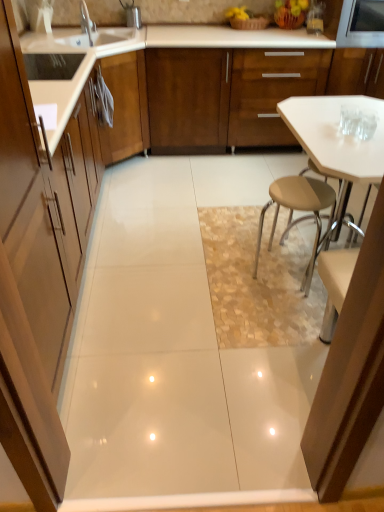
The image size is (384, 512). Describe the element at coordinates (227, 96) in the screenshot. I see `wooden cabinet at center, the second cabinetry positioned from the front` at that location.

Measure the distance between matte wood cabinet at left, which is counted as the first cabinetry, starting from the bottom, and camera.

The depth of matte wood cabinet at left, which is counted as the first cabinetry, starting from the bottom, is 35.73 inches.

What do you see at coordinates (336, 141) in the screenshot? I see `white glossy table at center` at bounding box center [336, 141].

Find the location of a particular element. The height and width of the screenshot is (512, 384). white glossy table at center is located at coordinates (336, 141).

Locate an element on the screen. The width and height of the screenshot is (384, 512). wooden cabinet at center, the second cabinetry positioned from the front is located at coordinates (227, 96).

Which object is positioned more to the right, wooden cabinet at center, the 1th cabinetry in the top-to-bottom sequence, or silver metallic faucet at upper left?

Positioned to the right is wooden cabinet at center, the 1th cabinetry in the top-to-bottom sequence.

From a real-world perspective, between wooden cabinet at center, the first cabinetry viewed from the right, and silver metallic faucet at upper left, who is vertically higher?

From a 3D spatial view, silver metallic faucet at upper left is above.

Is wooden cabinet at center, which is counted as the first cabinetry, starting from the back, not near silver metallic faucet at upper left?

Absolutely, wooden cabinet at center, which is counted as the first cabinetry, starting from the back, is distant from silver metallic faucet at upper left.

Considering the relative sizes of wooden cabinet at center, the 1th cabinetry in the top-to-bottom sequence, and silver metallic faucet at upper left in the image provided, is wooden cabinet at center, the 1th cabinetry in the top-to-bottom sequence, wider than silver metallic faucet at upper left?

Yes.

From a real-world perspective, which cabinetry is the 2nd one above the white glossy table at center? Please provide its 2D coordinates.

[(29, 292)]

Is white glossy table at center aimed at matte wood cabinet at left, placed as the second cabinetry when sorted from back to front?

Yes, white glossy table at center is turned towards matte wood cabinet at left, placed as the second cabinetry when sorted from back to front.

Does white glossy table at center have a larger size compared to matte wood cabinet at left, placed as the second cabinetry when sorted from back to front?

Correct, white glossy table at center is larger in size than matte wood cabinet at left, placed as the second cabinetry when sorted from back to front.

Which object is wider, matte wood cabinet at left, which is counted as the second cabinetry, starting from the right, or white glossy table at center?

Wider between the two is white glossy table at center.

From the image's perspective, is matte wood cabinet at left, which ranks as the 2th cabinetry in top-to-bottom order, below white glossy table at center?

Yes, from the image's perspective, matte wood cabinet at left, which ranks as the 2th cabinetry in top-to-bottom order, is beneath white glossy table at center.

Is matte wood cabinet at left, placed as the second cabinetry when sorted from back to front, to the left of white glossy table at center from the viewer's perspective?

Indeed, matte wood cabinet at left, placed as the second cabinetry when sorted from back to front, is positioned on the left side of white glossy table at center.

There is a metallic stainless steel microwave at upper right. At what (x,y) coordinates should I click in order to perform the action: click on the 2nd cabinetry below it (from the image's perspective). Please return your answer as a coordinate pair (x, y). Looking at the image, I should click on (29, 292).

Considering the relative positions of metallic stainless steel microwave at upper right and matte wood cabinet at left, placed as the second cabinetry when sorted from back to front, in the image provided, is metallic stainless steel microwave at upper right behind matte wood cabinet at left, placed as the second cabinetry when sorted from back to front,?

Yes, it is behind matte wood cabinet at left, placed as the second cabinetry when sorted from back to front.

Consider the image. Would you say metallic stainless steel microwave at upper right contains matte wood cabinet at left, which is counted as the second cabinetry, starting from the right?

No, matte wood cabinet at left, which is counted as the second cabinetry, starting from the right, is not a part of metallic stainless steel microwave at upper right.

Can you tell me how much wooden cabinet at center, positioned as the second cabinetry in bottom-to-top order, and matte wood cabinet at left, the first cabinetry when ordered from front to back, differ in facing direction?

91.9 degrees separate the facing orientations of wooden cabinet at center, positioned as the second cabinetry in bottom-to-top order, and matte wood cabinet at left, the first cabinetry when ordered from front to back.

Can you confirm if wooden cabinet at center, positioned as the second cabinetry in bottom-to-top order, is wider than matte wood cabinet at left, which is counted as the first cabinetry, starting from the bottom?

Yes, wooden cabinet at center, positioned as the second cabinetry in bottom-to-top order, is wider than matte wood cabinet at left, which is counted as the first cabinetry, starting from the bottom.

Is there a large distance between wooden cabinet at center, which appears as the second cabinetry when viewed from the left, and matte wood cabinet at left, the first cabinetry when ordered from front to back?

Yes, wooden cabinet at center, which appears as the second cabinetry when viewed from the left, and matte wood cabinet at left, the first cabinetry when ordered from front to back, are quite far apart.

How far apart are wooden cabinet at center, the first cabinetry viewed from the right, and matte wood cabinet at left, placed as the second cabinetry when sorted from back to front?

They are 2.08 meters apart.

Considering the sizes of objects wooden cabinet at center, positioned as the second cabinetry in bottom-to-top order, and metallic stainless steel microwave at upper right in the image provided, who is thinner, wooden cabinet at center, positioned as the second cabinetry in bottom-to-top order, or metallic stainless steel microwave at upper right?

wooden cabinet at center, positioned as the second cabinetry in bottom-to-top order, is thinner.

Which is behind, point (264, 114) or point (367, 11)?

The point (264, 114) is behind.

Consider the image. Does wooden cabinet at center, which appears as the second cabinetry when viewed from the left, have a lesser height compared to metallic stainless steel microwave at upper right?

In fact, wooden cabinet at center, which appears as the second cabinetry when viewed from the left, may be taller than metallic stainless steel microwave at upper right.

From the image's perspective, does wooden cabinet at center, which is counted as the first cabinetry, starting from the back, appear lower than metallic stainless steel microwave at upper right?

Yes, from the image's perspective, wooden cabinet at center, which is counted as the first cabinetry, starting from the back, is beneath metallic stainless steel microwave at upper right.

From a real-world perspective, is matte wood cabinet at left, which is counted as the first cabinetry, starting from the bottom, positioned above or below metallic stainless steel microwave at upper right?

matte wood cabinet at left, which is counted as the first cabinetry, starting from the bottom, is situated lower than metallic stainless steel microwave at upper right in the real world.

Would you say matte wood cabinet at left, the first cabinetry when ordered from front to back, is inside or outside metallic stainless steel microwave at upper right?

matte wood cabinet at left, the first cabinetry when ordered from front to back, lies outside metallic stainless steel microwave at upper right.

Is matte wood cabinet at left, which ranks as the 2th cabinetry in top-to-bottom order, in contact with metallic stainless steel microwave at upper right?

No, matte wood cabinet at left, which ranks as the 2th cabinetry in top-to-bottom order, is not in contact with metallic stainless steel microwave at upper right.

Where is `tap that is in front of the wooden cabinet at center, which is counted as the first cabinetry, starting from the back`? The width and height of the screenshot is (384, 512). tap that is in front of the wooden cabinet at center, which is counted as the first cabinetry, starting from the back is located at coordinates (87, 22).

I want to click on table above the matte wood cabinet at left, which is counted as the second cabinetry, starting from the right (from the image's perspective), so click(336, 141).

Considering their positions, is white glossy table at center positioned closer to matte wood cabinet at left, which is counted as the second cabinetry, starting from the right, than wooden cabinet at center, the second cabinetry positioned from the front?

white glossy table at center is positioned closer to the anchor matte wood cabinet at left, which is counted as the second cabinetry, starting from the right.

Considering their positions, is wooden cabinet at center, the 1th cabinetry in the top-to-bottom sequence, positioned closer to matte wood cabinet at left, which is counted as the second cabinetry, starting from the right, than silver metallic faucet at upper left?

Among the two, silver metallic faucet at upper left is located nearer to matte wood cabinet at left, which is counted as the second cabinetry, starting from the right.

When comparing their distances from wooden cabinet at center, the 1th cabinetry in the top-to-bottom sequence, does metallic stainless steel microwave at upper right or white glossy table at center seem closer?

Based on the image, metallic stainless steel microwave at upper right appears to be nearer to wooden cabinet at center, the 1th cabinetry in the top-to-bottom sequence.

From the image, which object appears to be farther from silver metallic faucet at upper left, wooden cabinet at center, positioned as the second cabinetry in bottom-to-top order, or white glossy table at center?

white glossy table at center.

Based on their spatial positions, is matte wood cabinet at left, which ranks as the 2th cabinetry in top-to-bottom order, or metallic stainless steel microwave at upper right closer to silver metallic faucet at upper left?

metallic stainless steel microwave at upper right is positioned closer to the anchor silver metallic faucet at upper left.

Estimate the real-world distances between objects in this image. Which object is closer to white glossy table at center, metallic stainless steel microwave at upper right or matte wood cabinet at left, which ranks as the 2th cabinetry in top-to-bottom order?

matte wood cabinet at left, which ranks as the 2th cabinetry in top-to-bottom order, is closer to white glossy table at center.

Which object lies nearer to the anchor point metallic stainless steel microwave at upper right, wooden cabinet at center, the second cabinetry positioned from the front, or matte wood cabinet at left, which is counted as the second cabinetry, starting from the right?

wooden cabinet at center, the second cabinetry positioned from the front, is closer to metallic stainless steel microwave at upper right.

Which object lies further to the anchor point matte wood cabinet at left, which ranks as the 1th cabinetry in left-to-right order, white glossy table at center or metallic stainless steel microwave at upper right?

metallic stainless steel microwave at upper right is further to matte wood cabinet at left, which ranks as the 1th cabinetry in left-to-right order.

You are a GUI agent. You are given a task and a screenshot of the screen. Output one action in this format:
    pyautogui.click(x=<x>, y=<y>)
    Task: Click on the tap between matte wood cabinet at left, which ranks as the 1th cabinetry in left-to-right order, and metallic stainless steel microwave at upper right in the front-back direction
    The image size is (384, 512).
    Given the screenshot: What is the action you would take?
    pyautogui.click(x=87, y=22)

Where is `table between matte wood cabinet at left, which ranks as the 2th cabinetry in top-to-bottom order, and silver metallic faucet at upper left, along the z-axis`? table between matte wood cabinet at left, which ranks as the 2th cabinetry in top-to-bottom order, and silver metallic faucet at upper left, along the z-axis is located at coordinates (336, 141).

Image resolution: width=384 pixels, height=512 pixels. What are the coordinates of `table positioned between matte wood cabinet at left, which is counted as the first cabinetry, starting from the bottom, and wooden cabinet at center, the second cabinetry positioned from the front, from near to far` in the screenshot? It's located at 336,141.

Where is `table located between matte wood cabinet at left, placed as the second cabinetry when sorted from back to front, and metallic stainless steel microwave at upper right in the depth direction`? The height and width of the screenshot is (512, 384). table located between matte wood cabinet at left, placed as the second cabinetry when sorted from back to front, and metallic stainless steel microwave at upper right in the depth direction is located at coordinates (336, 141).